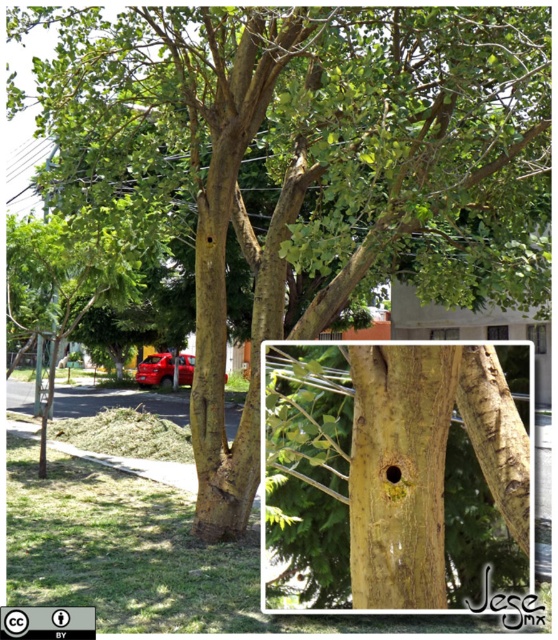
Question: Estimate the real-world distances between objects in this image. Which object is farther from the glossy red car at center?

Choices:
 (A) yellow rough bark at center
 (B) yellow rough bark hole at center
 (C) brown rough hole at center

Answer: (C)

Question: Considering the relative positions of yellow rough bark hole at center and yellow rough bark at center in the image provided, where is yellow rough bark hole at center located with respect to yellow rough bark at center?

Choices:
 (A) below
 (B) above

Answer: (A)

Question: Which is nearer to the yellow rough bark hole at center?

Choices:
 (A) brown rough hole at center
 (B) glossy red car at center

Answer: (A)

Question: Is yellow rough bark hole at center bigger than glossy red car at center?

Choices:
 (A) yes
 (B) no

Answer: (B)

Question: Among these objects, which one is farthest from the camera?

Choices:
 (A) brown rough hole at center
 (B) yellow rough bark at center
 (C) yellow rough bark hole at center

Answer: (A)

Question: Is yellow rough bark at center smaller than glossy red car at center?

Choices:
 (A) no
 (B) yes

Answer: (B)